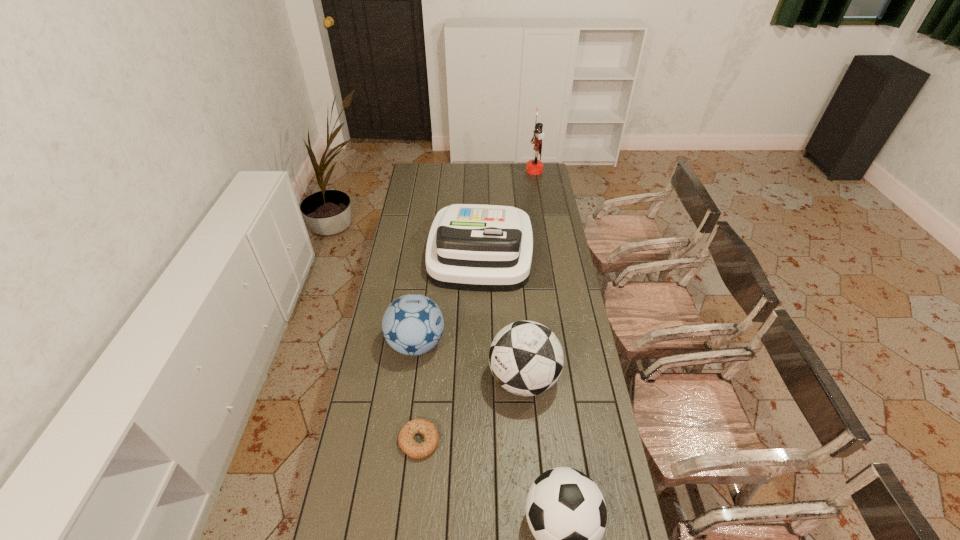
Locate an element on the screen. nutcracker is located at coordinates (535, 166).

The width and height of the screenshot is (960, 540). What are the coordinates of `the farthest object` in the screenshot? It's located at pyautogui.click(x=535, y=166).

Locate an element on the screen. The image size is (960, 540). the second farthest object is located at coordinates tap(471, 247).

Locate an element on the screen. This screenshot has width=960, height=540. the leftmost soccer ball is located at coordinates (413, 324).

The width and height of the screenshot is (960, 540). Identify the location of the second nearest object. (408, 445).

Identify the location of bagel. (408, 445).

The image size is (960, 540). In order to click on free region located 0.330m on the front-facing side of the farthest object in this screenshot , I will do [472, 171].

Identify the location of vacant region located 0.230m on the front-facing side of the farthest object. (489, 171).

Locate an element on the screen. vacant space located 0.050m on the front-facing side of the farthest object is located at coordinates (517, 171).

At what (x,y) coordinates should I click in order to perform the action: click on vacant space located 0.260m on the front of the cash register. Please return your answer as a coordinate pair (x, y). The image size is (960, 540). Looking at the image, I should click on (480, 338).